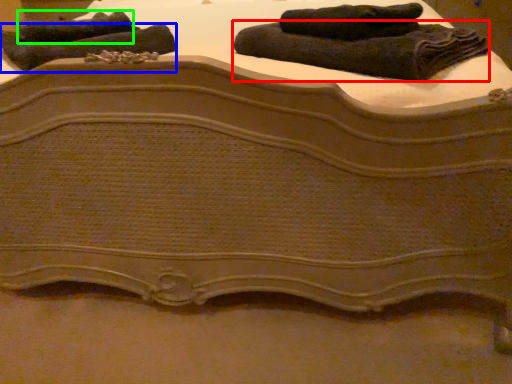
Question: Which object is the closest to the towel (highlighted by a red box)? Choose among these: towel (highlighted by a blue box) or towel (highlighted by a green box).

Choices:
 (A) towel
 (B) towel

Answer: (A)